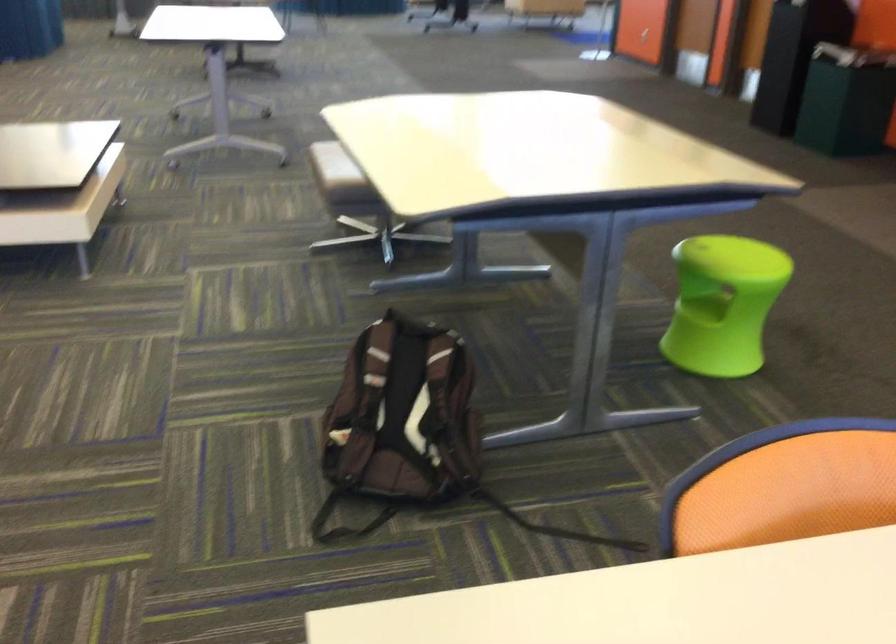
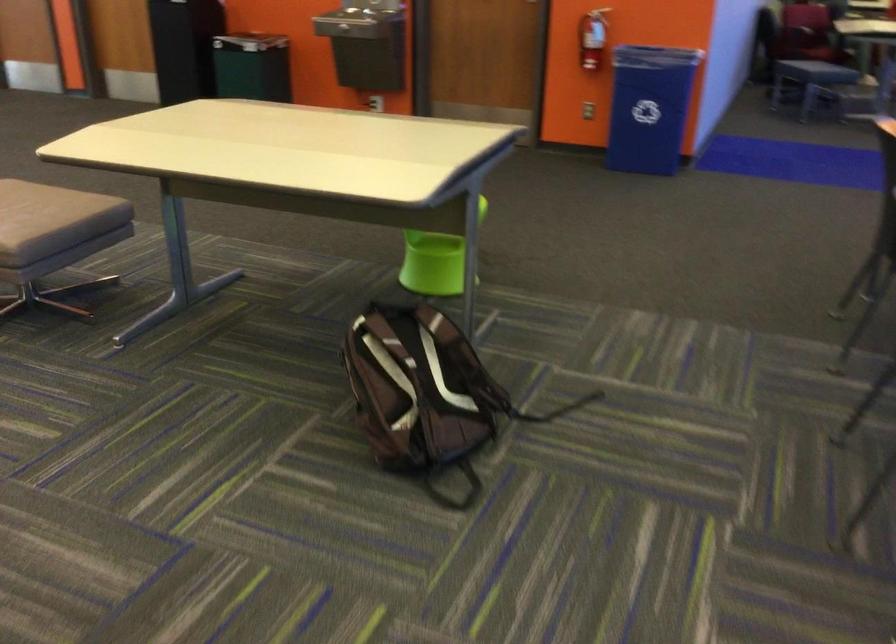
In the second image, find the point that corresponds to (368,413) in the first image.

(419, 392)